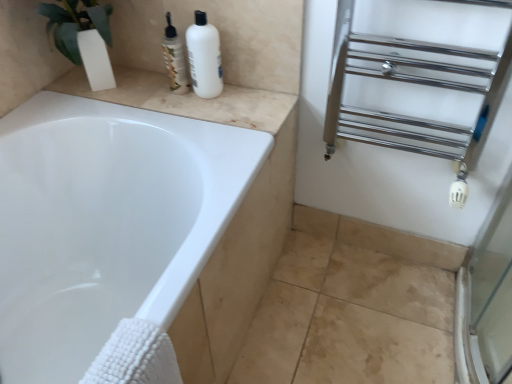
Identify the location of blank space to the left of white matte bottle at upper center. This screenshot has height=384, width=512. (156, 95).